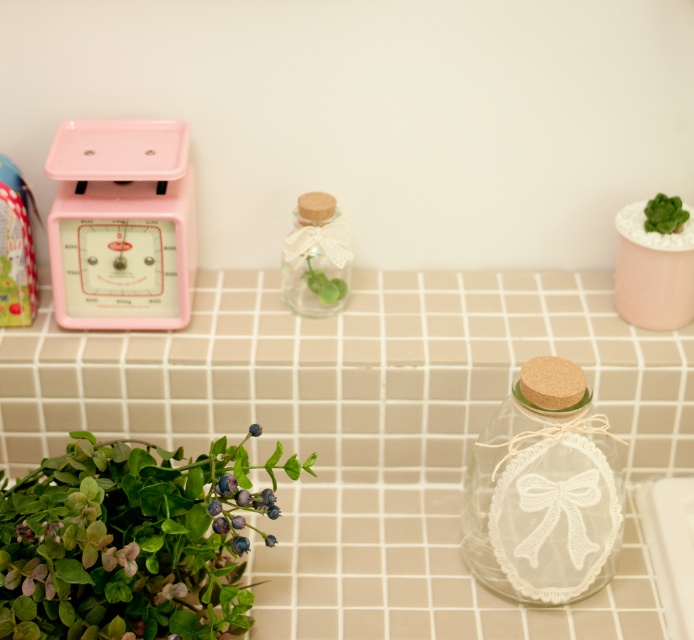
You are organizing items on a tiled surface and need to place the green matte plant at lower left and the matte pink scale at left. Based on their positions, which item is closer to the edge of the tiled surface?

The green matte plant at lower left is closer to the edge of the tiled surface because it is positioned below the matte pink scale at left, which would place it lower on the surface.

Based on the photo, you are arranging items on a tiled surface. You have a green matte plant at lower left and a clear glass bottle at center. Based on their positions, which item is closer to the right edge of the tiled surface?

The clear glass bottle at center is closer to the right edge of the tiled surface because it is positioned to the right of the green matte plant at lower left.